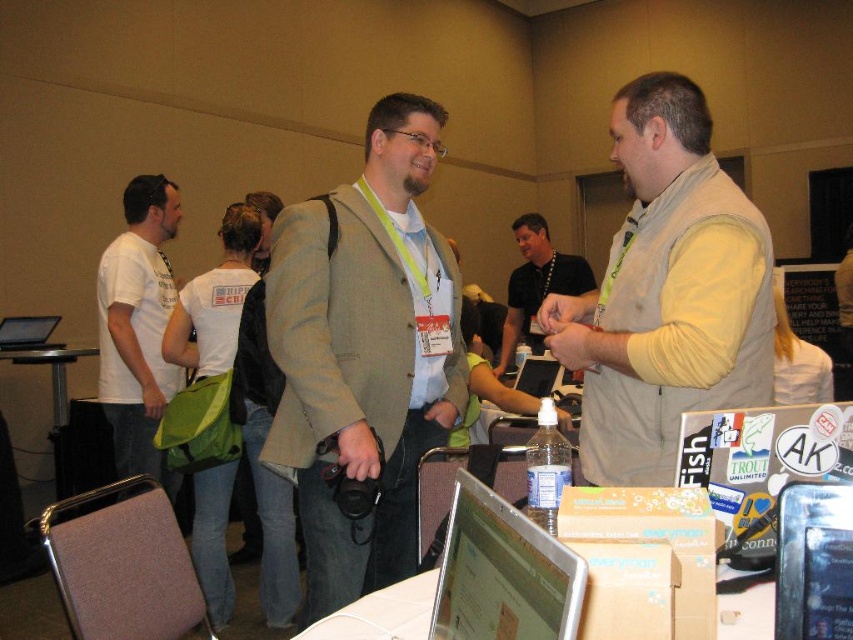
Question: Does light brown textured blazer at center appear on the right side of matte black laptop at center?

Choices:
 (A) yes
 (B) no

Answer: (B)

Question: Is metallic blue computer at lower right positioned before metallic silver table at lower left?

Choices:
 (A) yes
 (B) no

Answer: (A)

Question: Estimate the real-world distances between objects in this image. Which object is closer to the light brown textured blazer at center?

Choices:
 (A) light beige vest at center
 (B) matte black laptop at left

Answer: (A)

Question: Does silver metallic laptop at lower center have a larger size compared to matte black laptop at center?

Choices:
 (A) no
 (B) yes

Answer: (A)

Question: Which point is farther to the camera?

Choices:
 (A) (125, 406)
 (B) (349, 618)

Answer: (A)

Question: Based on their relative distances, which object is nearer to the matte black laptop at left?

Choices:
 (A) silver metallic laptop at center
 (B) silver metallic laptop at lower center
 (C) metallic blue computer at lower right
 (D) matte black laptop at center

Answer: (D)